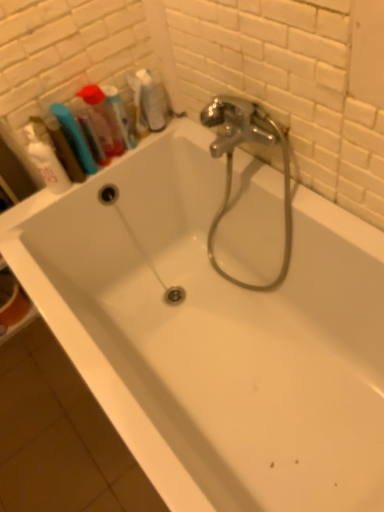
Question: Considering the positions of point (82, 129) and point (124, 125), is point (82, 129) closer or farther from the camera than point (124, 125)?

Choices:
 (A) farther
 (B) closer

Answer: (B)

Question: Is translucent plastic container at upper left bigger or smaller than translucent plastic mouthwash at upper left, which appears as the 3th mouthwash when viewed from the left?

Choices:
 (A) small
 (B) big

Answer: (B)

Question: Estimate the real-world distances between objects in this image. Which object is closer to the translucent plastic container at upper left?

Choices:
 (A) white matte shaving cream at upper left
 (B) translucent plastic mouthwash at upper left, which appears as the 3th mouthwash when viewed from the left
 (C) translucent plastic mouthwash at upper left, the 2th mouthwash when ordered from right to left
 (D) translucent plastic mouthwash at upper left, positioned as the third mouthwash in right-to-left order

Answer: (C)

Question: Which of these objects is positioned farthest from the translucent plastic mouthwash at upper left, positioned as the third mouthwash in right-to-left order?

Choices:
 (A) translucent plastic mouthwash at upper left, placed as the 1th mouthwash when sorted from right to left
 (B) translucent plastic mouthwash at upper left, the 2th mouthwash when ordered from right to left
 (C) white matte shaving cream at upper left
 (D) translucent plastic container at upper left

Answer: (A)